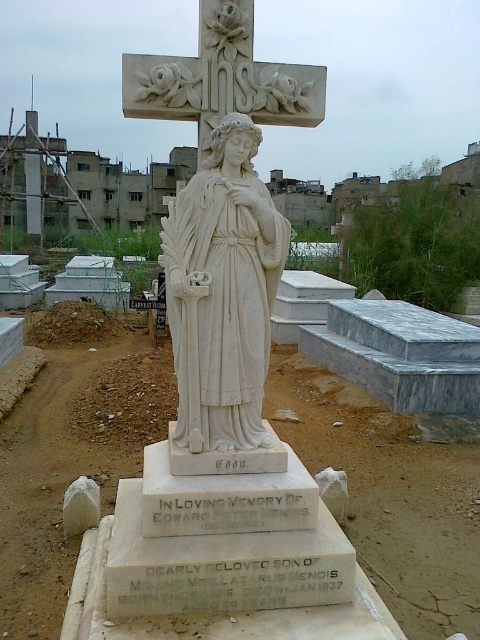
You are standing in front of the tombstone and want to place a bouquet of flowers between the dirtloose soildirt field at center and the white marble cross at upper center. Which object should you place the bouquet closer to to ensure it is in front of the cross?

The dirtloose soildirt field at center is further to the viewer than the white marble cross at upper center, so placing the bouquet closer to the dirtloose soildirt field at center will ensure it is in front of the cross.

In the scene shown: You are standing in front of the tombstone and want to place a bouquet of flowers. You have two options to place it either in front of the white marble statue at center or below the white marble cross at upper center. Which placement would allow the bouquet to be closer to the ground?

The white marble cross at upper center is shorter than the white marble statue at center, so placing the bouquet below the white marble cross at upper center would be closer to the ground.

You are a sculptor who wants to place a small plaque between the white marble statue at center and the white marble cross at upper center. The plaque is 10 inches wide. Is there enough space between them to fit the plaque without overlapping either object?

The distance between the white marble statue at center and the white marble cross at upper center is 26.69 inches. Since the plaque is only 10 inches wide, there is sufficient space to place it between them without overlapping either object.